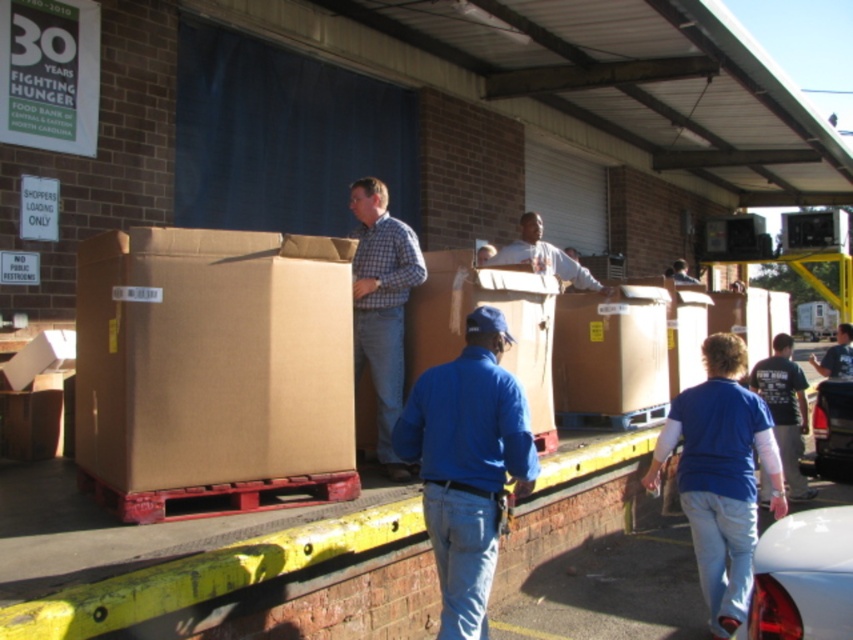
Question: Among these points, which one is nearest to the camera?

Choices:
 (A) (828, 476)
 (B) (670, 412)
 (C) (776, 385)

Answer: (B)

Question: Observing the image, what is the correct spatial positioning of shiny white car at lower right in reference to checkered fabric shirt at center?

Choices:
 (A) right
 (B) left

Answer: (A)

Question: Which point is farther to the camera?

Choices:
 (A) brown cardboard box at center
 (B) dark blue shirt at center
 (C) shiny white car at lower right

Answer: (B)

Question: Can you confirm if shiny white car at lower right is positioned below shiny black car at lower right?

Choices:
 (A) yes
 (B) no

Answer: (B)

Question: Which object is the closest to the white matte shirt at center?

Choices:
 (A) shiny white car at lower right
 (B) shiny black car at lower right

Answer: (B)

Question: From the image, what is the correct spatial relationship of brown cardboard box at center in relation to shiny white car at lower right?

Choices:
 (A) above
 (B) below

Answer: (A)